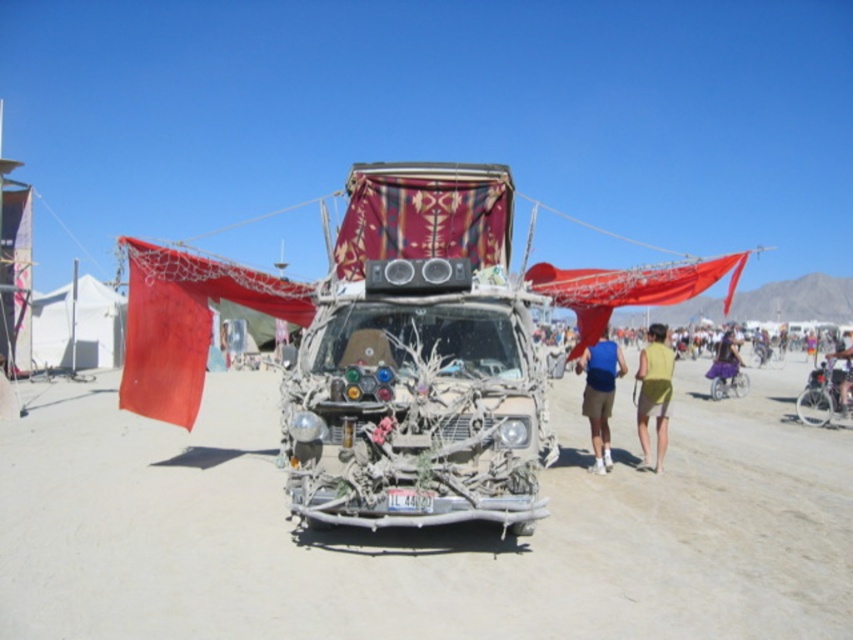
You are planning to park your car next to the decorative wood van at center and the purple fabric skirt at right. Which object takes up more horizontal space?

The purple fabric skirt at right has a greater width than the decorative wood van at center, so it occupies more horizontal space.

You are standing at the center of the image and want to reach the metallic silver bicycle at lower right. Based on the coordinates provided in the description, is the bicycle positioned to your left or right side?

The metallic silver bicycle at lower right is located at point coordinates with an x value of 0.619, which places it to the right side of the image from your perspective. Since you are at the center, the bicycle is positioned to your right.

You are standing in front of the decorative wood van at center and want to place a small potted plant on the purple fabric skirt at right. Based on their positions, can you tell if the skirt is positioned lower than the van?

The decorative wood van at center is located above the purple fabric skirt at right, so yes, the skirt is positioned lower than the van.